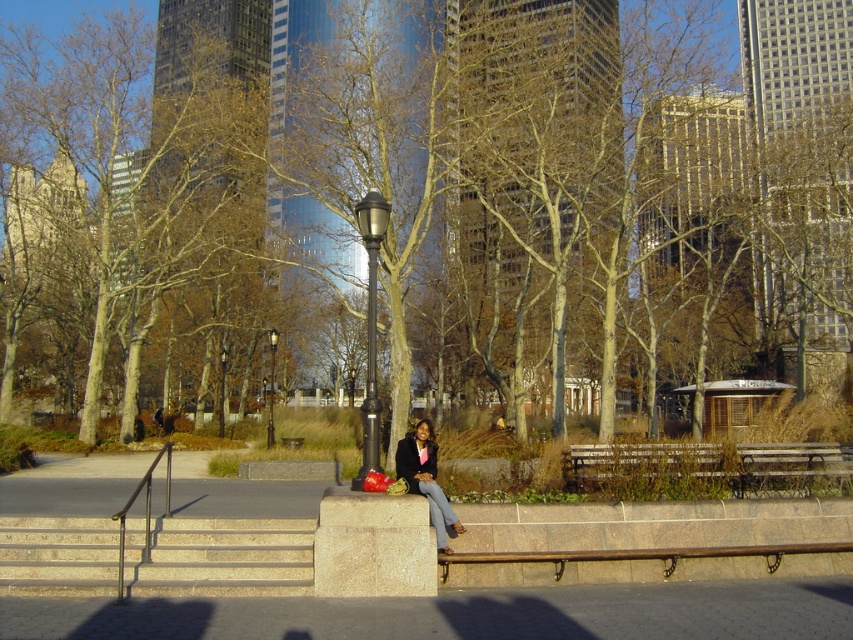
You are a visitor in the park and want to take a photo of the brown bark tree at center and the beige stone stairs at lower left. Which object should you position to your left to frame them both in the shot?

To frame both the brown bark tree at center and the beige stone stairs at lower left in the photo, position the beige stone stairs at lower left to your left side since the brown bark tree at center is to the right of the beige stone stairs at lower left.

You are standing at the entrance of the park and see the beige stone stairs at lower left. Can you determine their exact location in the image?

The beige stone stairs at lower left are located at point (221, 557).

Based on the photo, you are a park visitor who wants to take a photo of the brown bark tree at center from the beige stone stairs at lower left. Considering the distance between them, do you think you can clearly capture the tree in your photo without zooming in?

The brown bark tree at center and beige stone stairs at lower left are 77.83 feet apart. At this distance, you would need to zoom in to clearly capture the tree in your photo from the stairs.